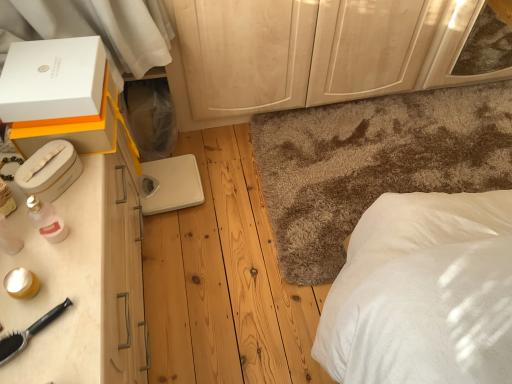
Where is `vacant area situated below shaggy carpet at center (from a real-world perspective)`? The height and width of the screenshot is (384, 512). vacant area situated below shaggy carpet at center (from a real-world perspective) is located at coordinates (423, 155).